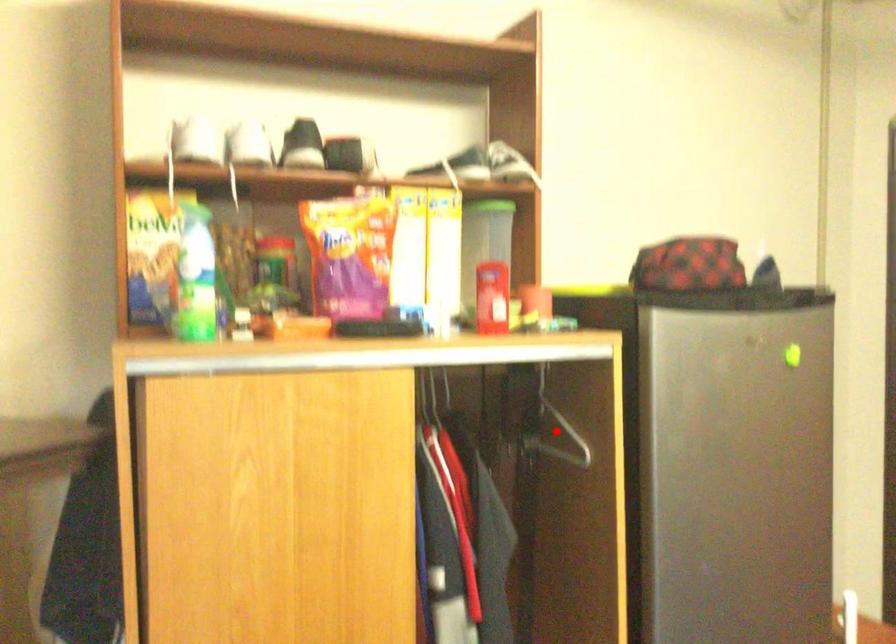
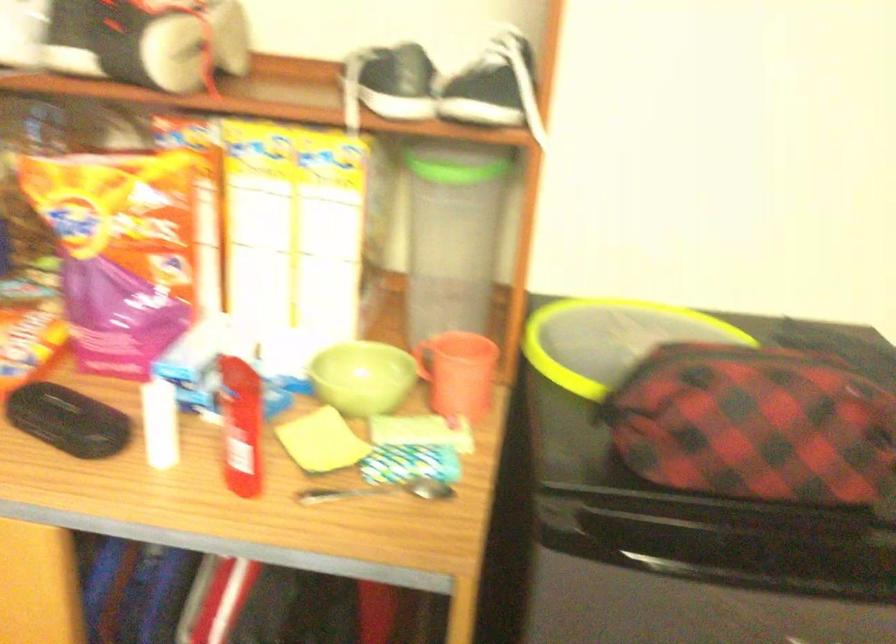
Question: I am providing you with two images of the same scene from different viewpoints. A red point is marked on the first image. Is the red point's position out of view in image 2?

Choices:
 (A) Yes
 (B) No

Answer: (A)